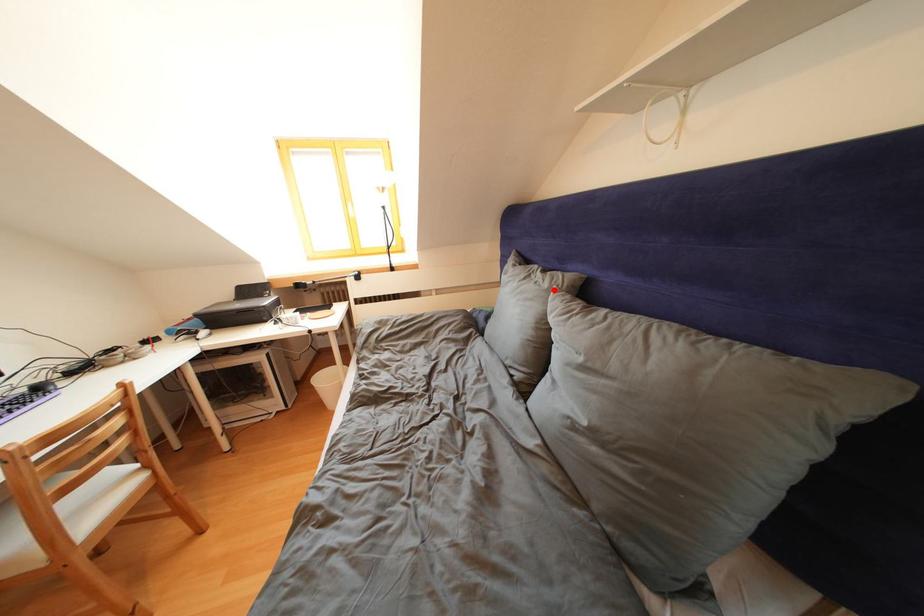
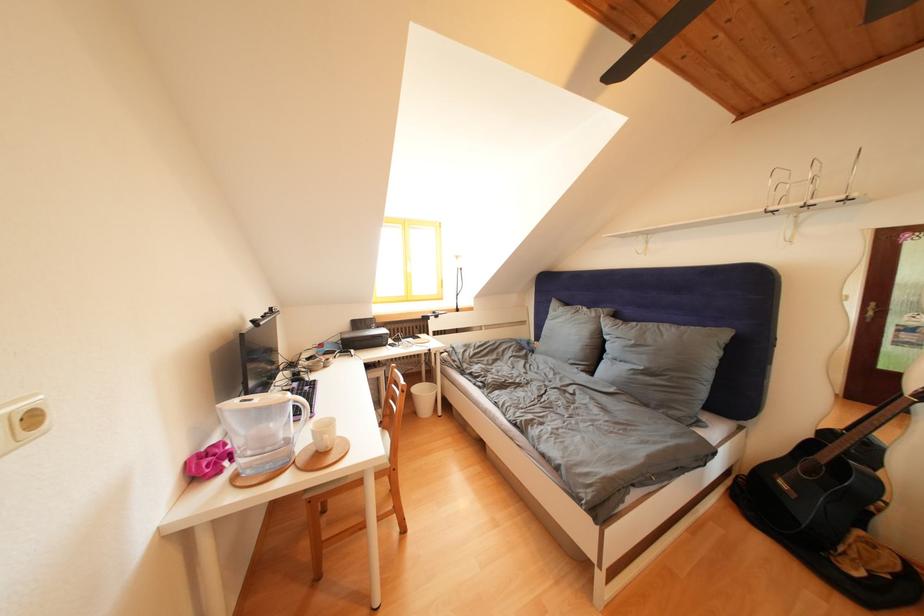
Find the pixel in the second image that matches the highlighted location in the first image.

(602, 320)